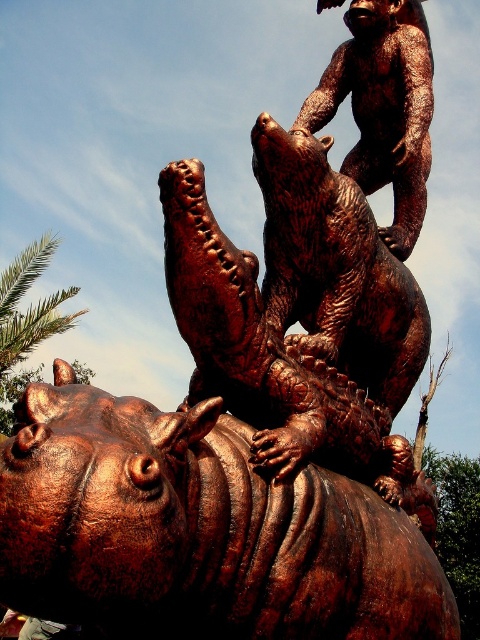
Measure the distance between bronze textured bear at center and bronze bear at upper center.

A distance of 1.42 meters exists between bronze textured bear at center and bronze bear at upper center.

Measure the distance between bronze textured bear at center and camera.

bronze textured bear at center and camera are 23.43 feet apart from each other.

This screenshot has height=640, width=480. I want to click on bronze textured bear at center, so click(x=336, y=269).

Is bronze textured hippo at center shorter than bronze textured bear at center?

Correct, bronze textured hippo at center is not as tall as bronze textured bear at center.

Does point (391, 632) come behind point (283, 256)?

That is False.

Between point (292, 632) and point (301, 204), which one is positioned behind?

The point (301, 204) is behind.

Locate an element on the screen. This screenshot has width=480, height=640. bronze textured hippo at center is located at coordinates pyautogui.click(x=197, y=531).

Is bronze textured hippo at center further to camera compared to bronze bear at upper center?

No, bronze textured hippo at center is in front of bronze bear at upper center.

Does bronze textured hippo at center appear on the left side of bronze bear at upper center?

Yes, bronze textured hippo at center is to the left of bronze bear at upper center.

The image size is (480, 640). Describe the element at coordinates (197, 531) in the screenshot. I see `bronze textured hippo at center` at that location.

At what (x,y) coordinates should I click in order to perform the action: click on bronze textured hippo at center. Please return your answer as a coordinate pair (x, y). Looking at the image, I should click on (197, 531).